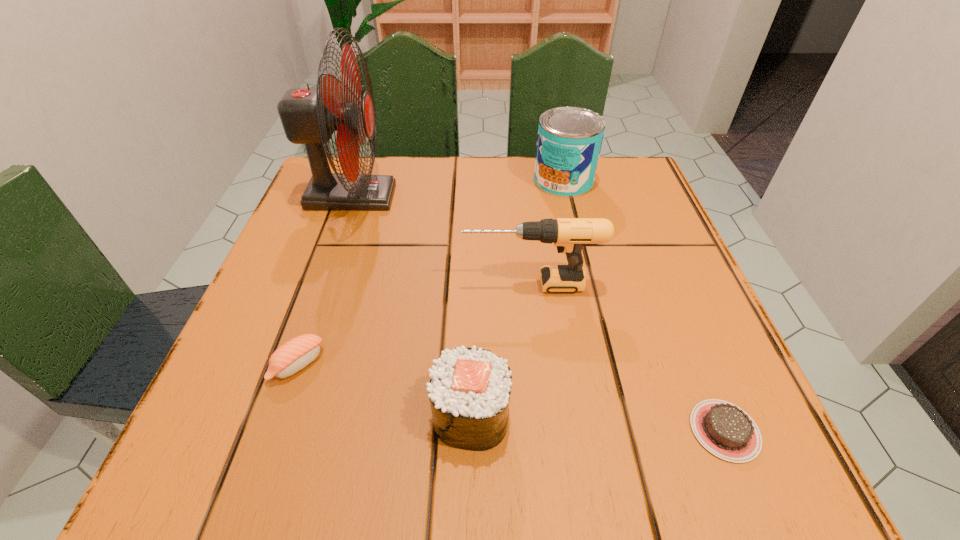
Where is `vacant space that's between the right sushi and the shortest object`? This screenshot has width=960, height=540. vacant space that's between the right sushi and the shortest object is located at coordinates (598, 423).

I want to click on free space between the fourth tallest object and the can, so click(516, 298).

Identify the location of empty space that is in between the can and the shorter sushi. The height and width of the screenshot is (540, 960). (431, 273).

The height and width of the screenshot is (540, 960). Find the location of `object that is the second closest one to the second shortest object`. object that is the second closest one to the second shortest object is located at coordinates (569, 235).

The height and width of the screenshot is (540, 960). Find the location of `the second closest object relative to the can`. the second closest object relative to the can is located at coordinates (309, 116).

Where is `free location that satisfies the following two spatial constraints: 1. on the front side of the fifth tallest object; 2. on the left side of the chocolate cake`? The width and height of the screenshot is (960, 540). free location that satisfies the following two spatial constraints: 1. on the front side of the fifth tallest object; 2. on the left side of the chocolate cake is located at coordinates (276, 430).

The width and height of the screenshot is (960, 540). In order to click on free spot that satisfies the following two spatial constraints: 1. on the front-facing side of the fan; 2. on the right side of the second shortest object in this screenshot , I will do `click(292, 364)`.

Find the location of a particular element. free space that satisfies the following two spatial constraints: 1. on the front side of the left sushi; 2. on the right side of the chocolate cake is located at coordinates (276, 430).

Find the location of a particular element. Image resolution: width=960 pixels, height=540 pixels. free location that satisfies the following two spatial constraints: 1. on the front side of the right sushi; 2. on the right side of the rightmost object is located at coordinates (470, 430).

Find the location of a particular element. free space that satisfies the following two spatial constraints: 1. on the front-facing side of the fan; 2. on the right side of the shorter sushi is located at coordinates (292, 364).